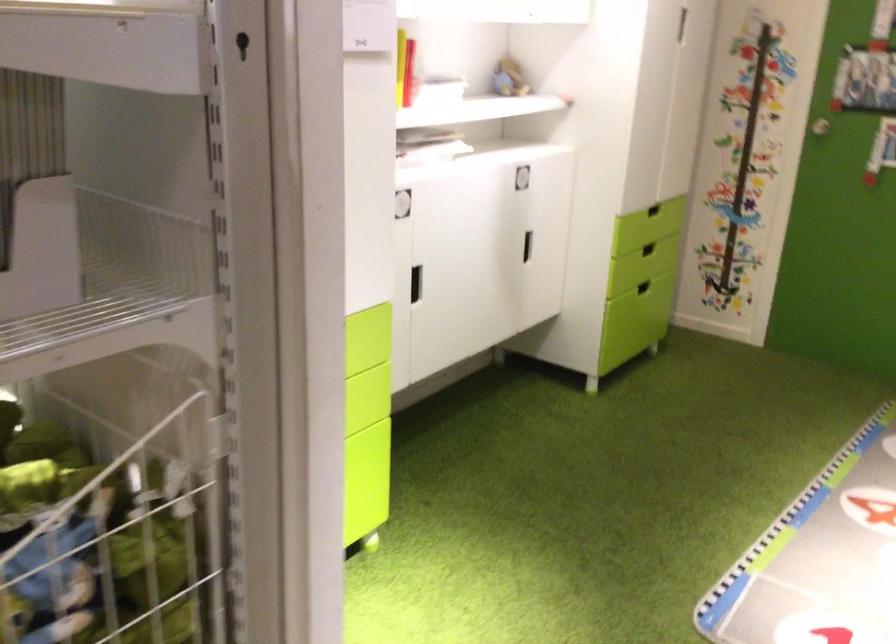
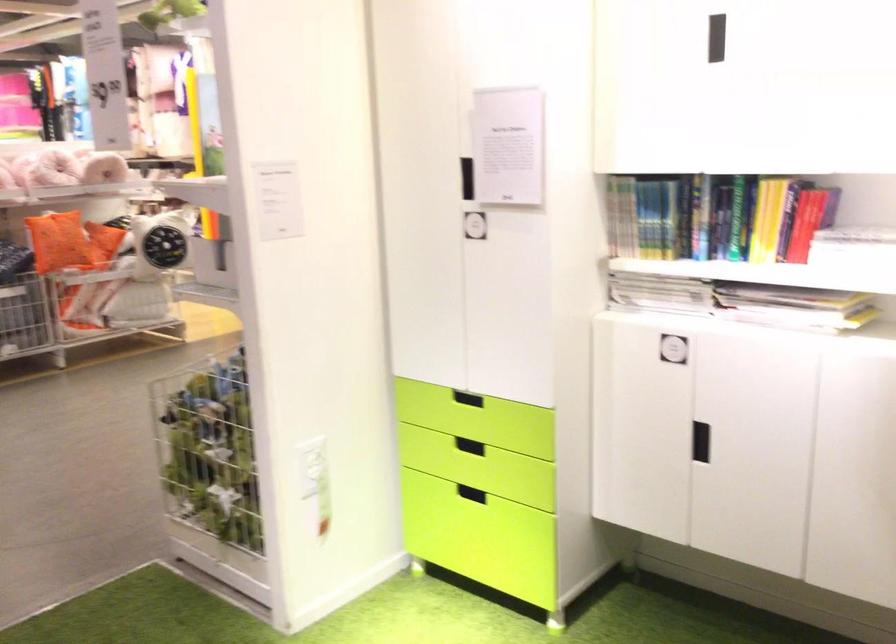
The point at (431, 146) is marked in the first image. Where is the corresponding point in the second image?

(794, 307)